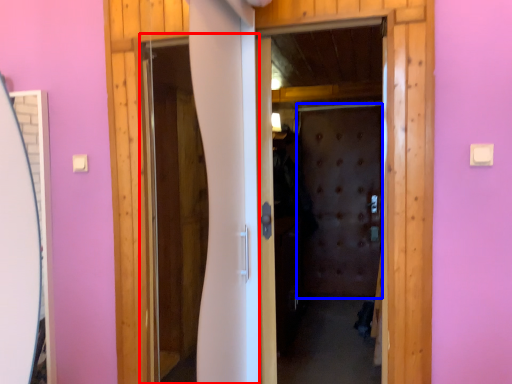
Question: Which object is closer to the camera taking this photo, screen door (highlighted by a red box) or screen door (highlighted by a blue box)?

Choices:
 (A) screen door
 (B) screen door

Answer: (A)